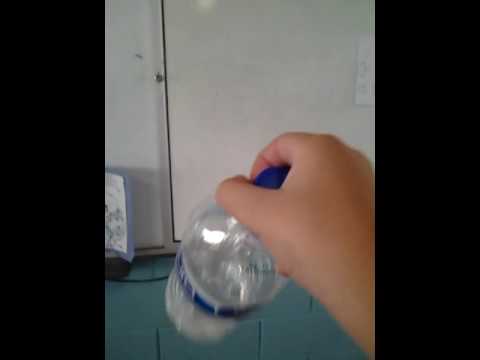
The width and height of the screenshot is (480, 360). I want to click on wall, so click(x=130, y=132).